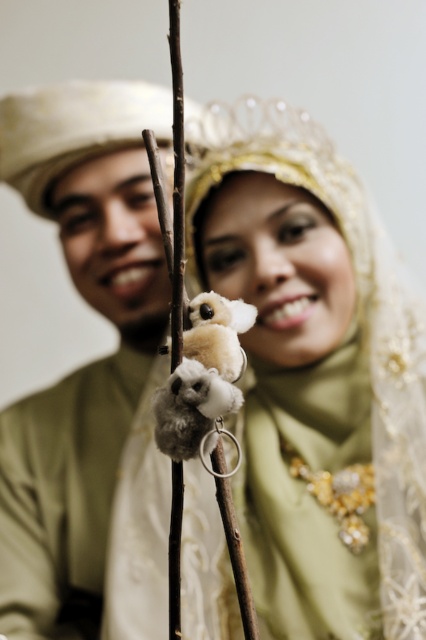
You are a photographer setting up for a cultural wedding photo shoot. You need to ensure that the matte gold turban at left and the fluffy white and gray plush toy at center are both visible in the frame. Given their height difference, which object will require you to adjust your camera angle upwards to capture properly?

The matte gold turban at left is much taller than the fluffy white and gray plush toy at center, so you will need to adjust your camera angle upwards to capture the matte gold turban at left properly.

Please look at the image. There is a matte green scarf at center. Where exactly is it located in terms of coordinates?

The matte green scarf at center is located at coordinates point (317, 378).